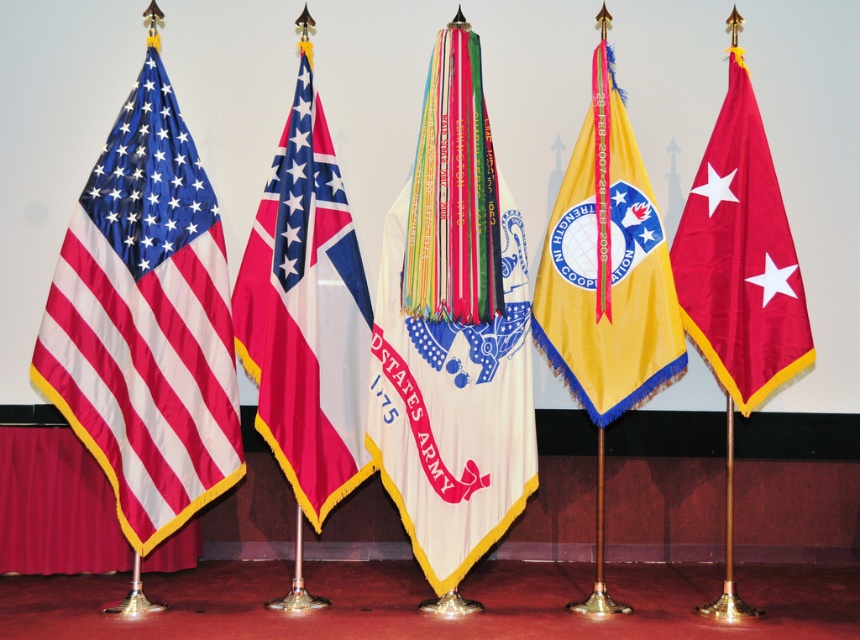
Is white fabric flag at center above matte red flag with white stars at right?

No.

Does white fabric flag at center lie behind matte red flag with white stars at right?

No, it is not.

The height and width of the screenshot is (640, 860). Describe the element at coordinates (453, 336) in the screenshot. I see `white fabric flag at center` at that location.

Image resolution: width=860 pixels, height=640 pixels. I want to click on white fabric flag at center, so click(x=453, y=336).

Who is more forward, (241, 273) or (645, 204)?

Positioned in front is point (241, 273).

The image size is (860, 640). What do you see at coordinates (306, 314) in the screenshot? I see `polyester flag at center` at bounding box center [306, 314].

Where is `polyester flag at center`? The height and width of the screenshot is (640, 860). polyester flag at center is located at coordinates (306, 314).

Is point (397, 314) closer to viewer compared to point (572, 218)?

Yes, it is.

Is white fabric flag at center smaller than yellow fabric flag at center?

Incorrect, white fabric flag at center is not smaller in size than yellow fabric flag at center.

The height and width of the screenshot is (640, 860). What are the coordinates of `white fabric flag at center` in the screenshot? It's located at (453, 336).

Image resolution: width=860 pixels, height=640 pixels. I want to click on white fabric flag at center, so click(453, 336).